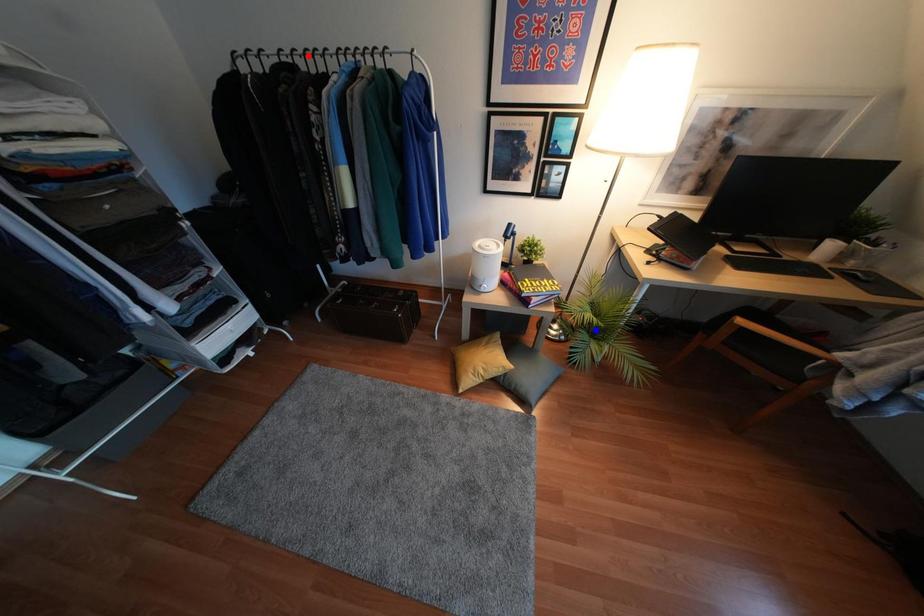
Question: In the image, two points are highlighted. Which point is nearer to the camera? Reply with the corresponding letter.

Choices:
 (A) blue point
 (B) red point

Answer: (B)